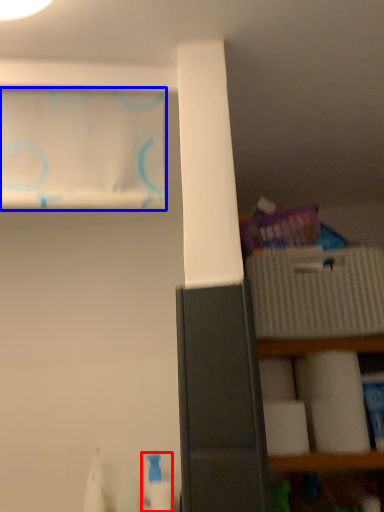
Question: Which of the following is the closest to the observer, cleaning product (highlighted by a red box) or curtain (highlighted by a blue box)?

Choices:
 (A) cleaning product
 (B) curtain

Answer: (B)